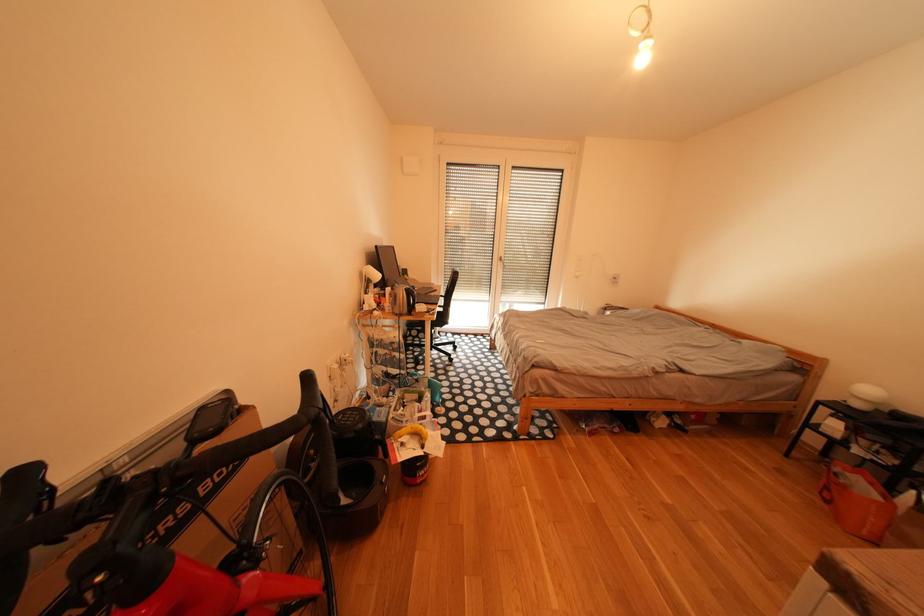
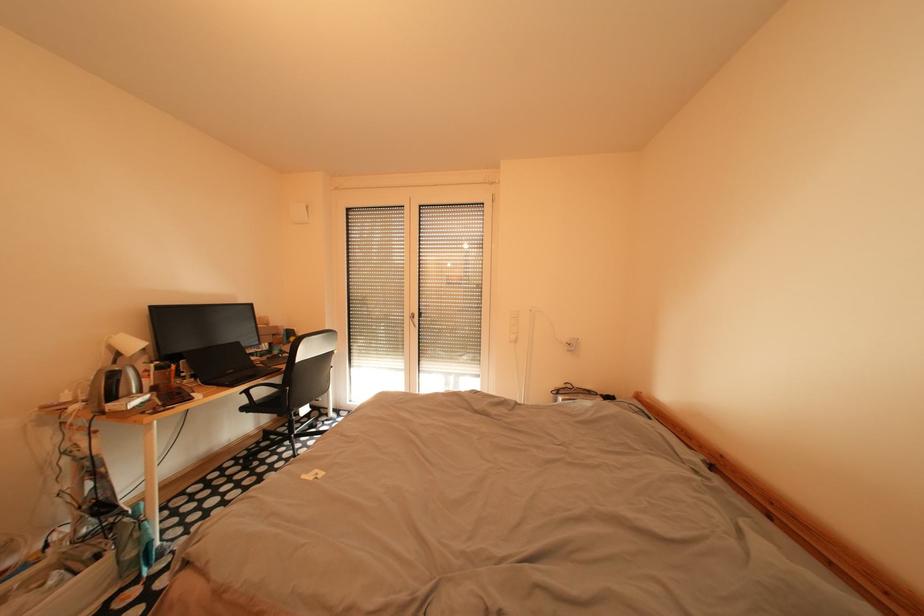
The images are taken continuously from a first-person perspective. In which direction are you moving?

The movement direction of the cameraman is right, forward.